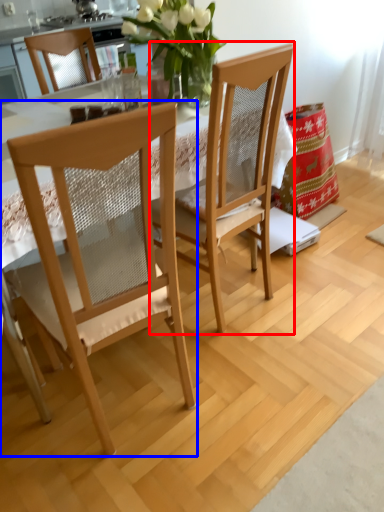
Question: Which object appears closest to the camera in this image, chair (highlighted by a red box) or chair (highlighted by a blue box)?

Choices:
 (A) chair
 (B) chair

Answer: (B)